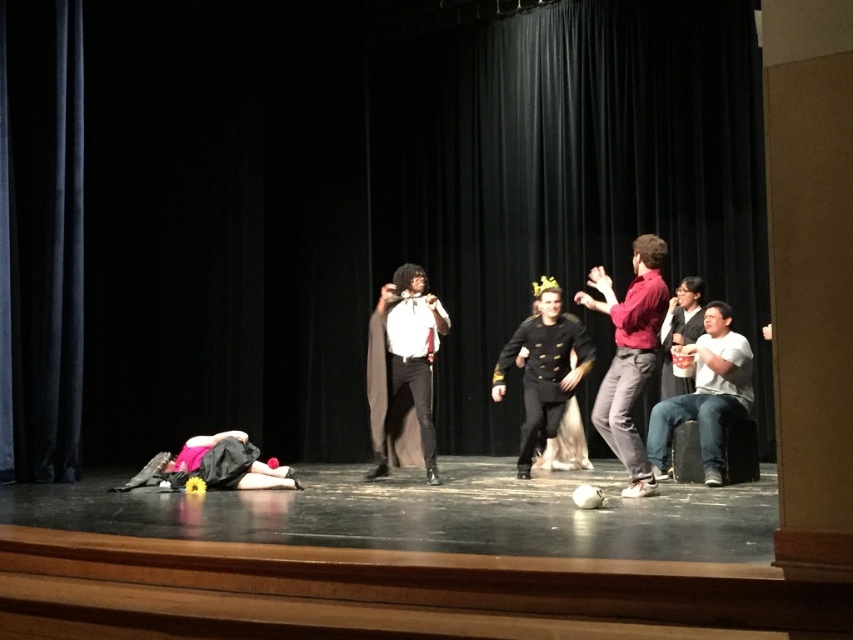
You are a stagehand observing the performance. There is a jeans at right represented by point (706, 394). Where is the jeans located in the stage coordinates?

The jeans at right is located at coordinates (706, 394).

You are a stagehand who needs to move a 5 meter long ladder from the black velvet curtain at center to the matte red shirt at center. Can you safely move the ladder without it hitting anything?

The distance between the black velvet curtain at center and the matte red shirt at center is 4.68 meters. Since the ladder is 5 meters long, it would extend beyond the available space, making it unsafe to move the ladder without it hitting something.